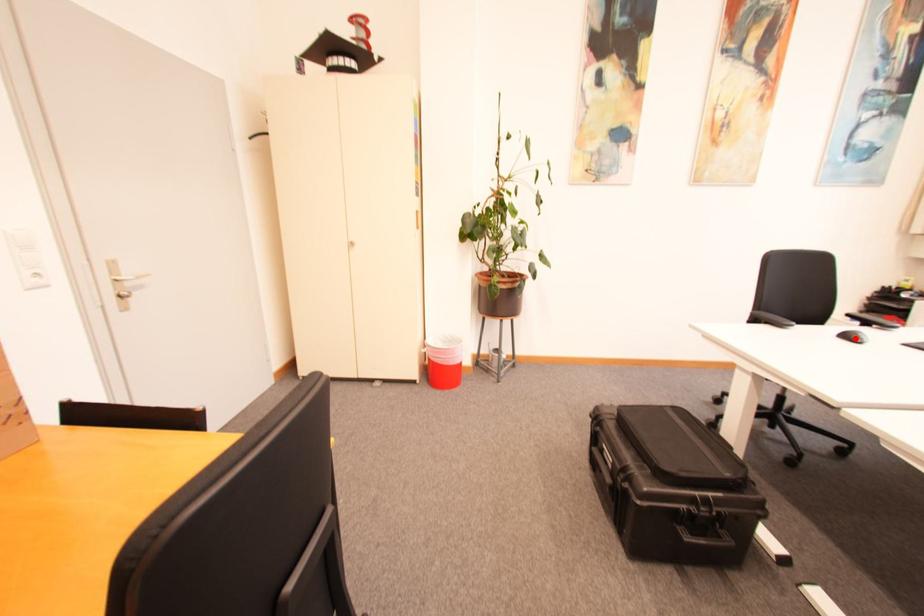
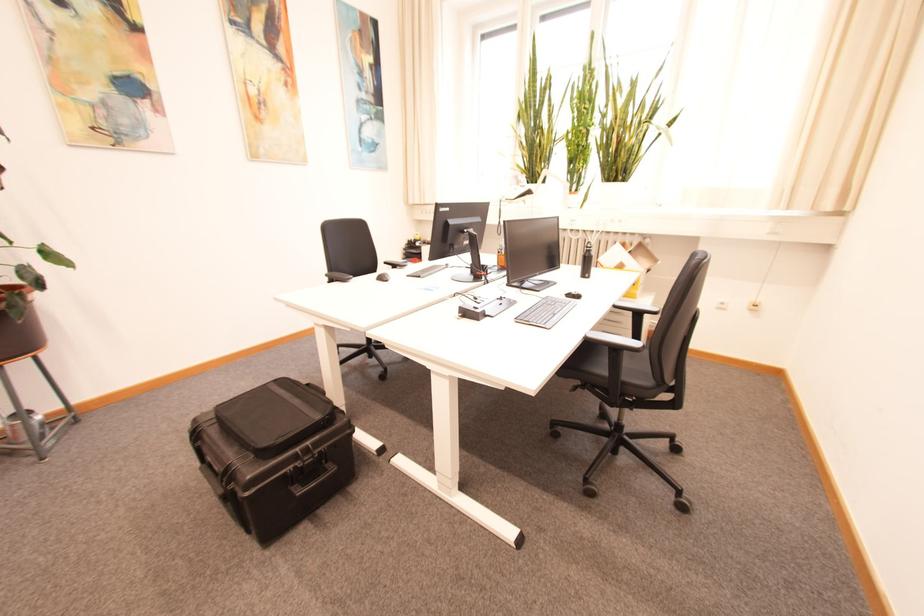
Where in the second image is the point corresponding to the highlighted location from the first image?

(388, 280)